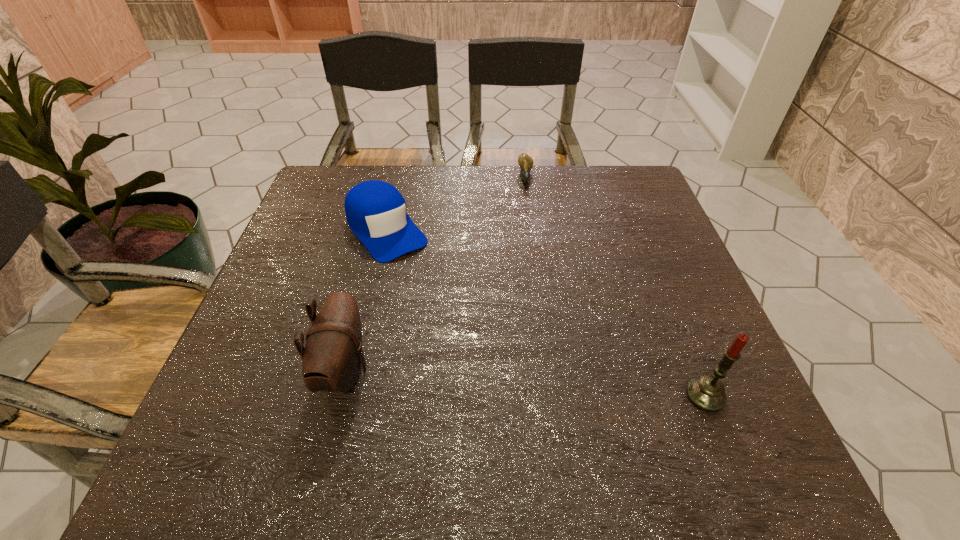
Locate an element on the screen. vacant space in between the rightmost object and the pouch is located at coordinates (525, 383).

The height and width of the screenshot is (540, 960). Find the location of `vacant point located between the pouch and the third object from left to right`. vacant point located between the pouch and the third object from left to right is located at coordinates (435, 274).

Where is `empty space that is in between the third tallest object and the second object from right to left`? empty space that is in between the third tallest object and the second object from right to left is located at coordinates (456, 204).

The image size is (960, 540). I want to click on vacant point located between the shortest object and the pouch, so [435, 274].

The image size is (960, 540). In order to click on vacant area that lies between the candle and the escargot in this screenshot , I will do `click(615, 286)`.

Locate an element on the screen. blank region between the third tallest object and the pouch is located at coordinates (366, 300).

This screenshot has height=540, width=960. Identify the location of unoccupied area between the pouch and the rightmost object. (525, 383).

Where is `object that is the third closest to the pouch`? This screenshot has height=540, width=960. object that is the third closest to the pouch is located at coordinates (525, 162).

Identify which object is located as the second nearest to the shortest object. Please provide its 2D coordinates. Your answer should be formatted as a tuple, i.e. [(x, y)], where the tuple contains the x and y coordinates of a point satisfying the conditions above.

[(331, 360)]